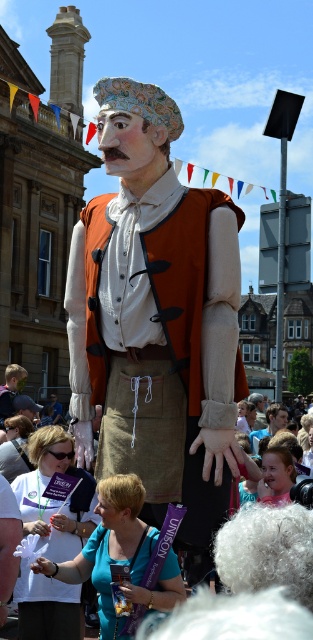
Does matte orange vest at center come in front of white fabric at center?

Yes, matte orange vest at center is closer to the viewer.

Is matte orange vest at center thinner than white fabric at center?

No.

Who is more distant from viewer, (183,212) or (47,508)?

The point (47,508) is behind.

I want to click on matte orange vest at center, so click(157, 317).

Between white fabric at center and blue fabric at lower center, which one has less height?

blue fabric at lower center is shorter.

Does white fabric at center have a lesser height compared to blue fabric at lower center?

In fact, white fabric at center may be taller than blue fabric at lower center.

At what (x,y) coordinates should I click in order to perform the action: click on white fabric at center. Please return your answer as a coordinate pair (x, y). Looking at the image, I should click on (72, 520).

Can you confirm if matte orange vest at center is taller than blue fabric at lower center?

Indeed, matte orange vest at center has a greater height compared to blue fabric at lower center.

Does matte orange vest at center lie in front of blue fabric at lower center?

Yes, matte orange vest at center is closer to the viewer.

Image resolution: width=313 pixels, height=640 pixels. I want to click on matte orange vest at center, so click(157, 317).